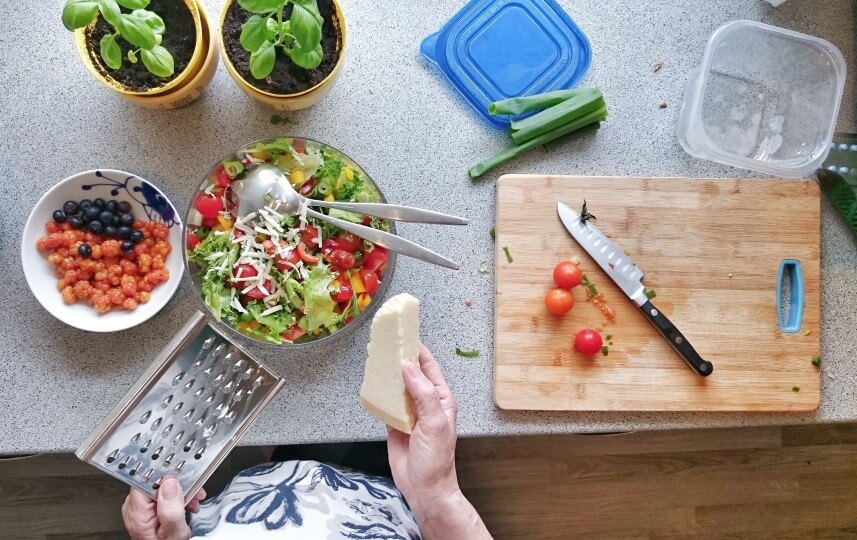
What are the coordinates of `flower pot` in the screenshot? It's located at (206, 73), (327, 83).